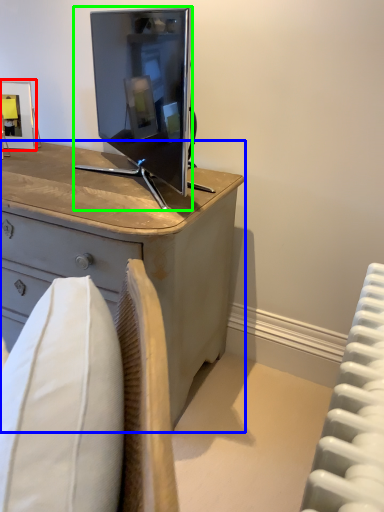
Question: Estimate the real-world distances between objects in this image. Which object is closer to picture frame (highlighted by a red box), desk (highlighted by a blue box) or television (highlighted by a green box)?

Choices:
 (A) desk
 (B) television

Answer: (B)